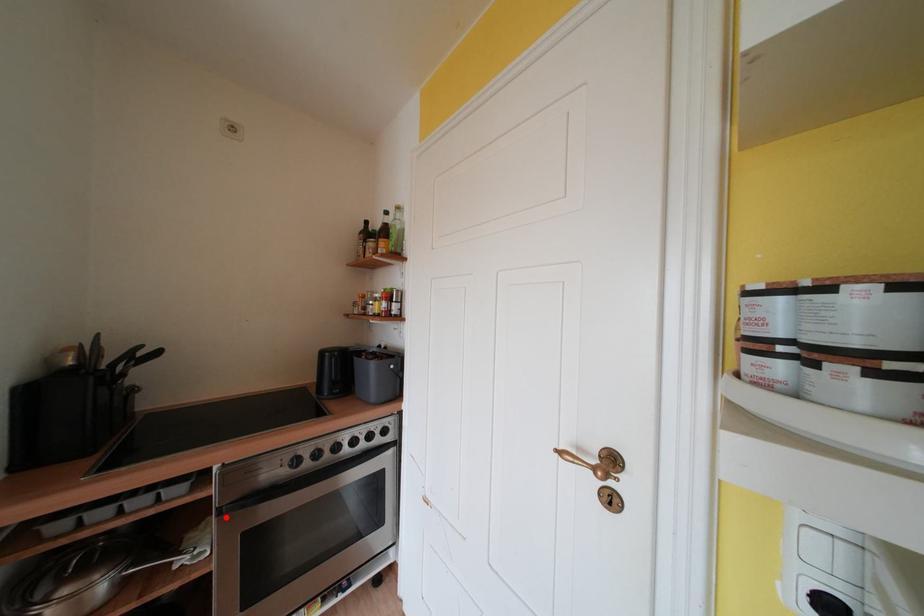
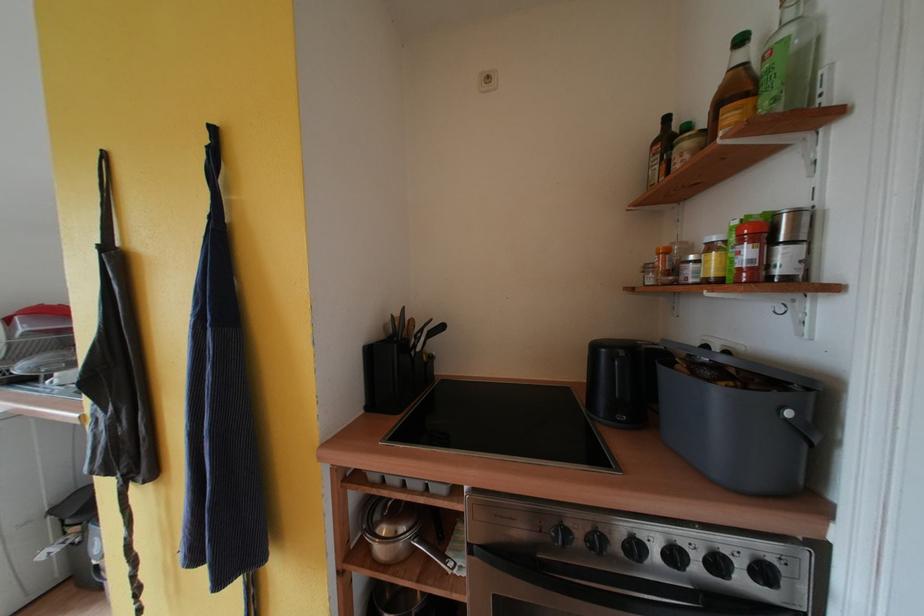
Where in the second image is the point corresponding to the highlighted location from the first image?

(478, 553)